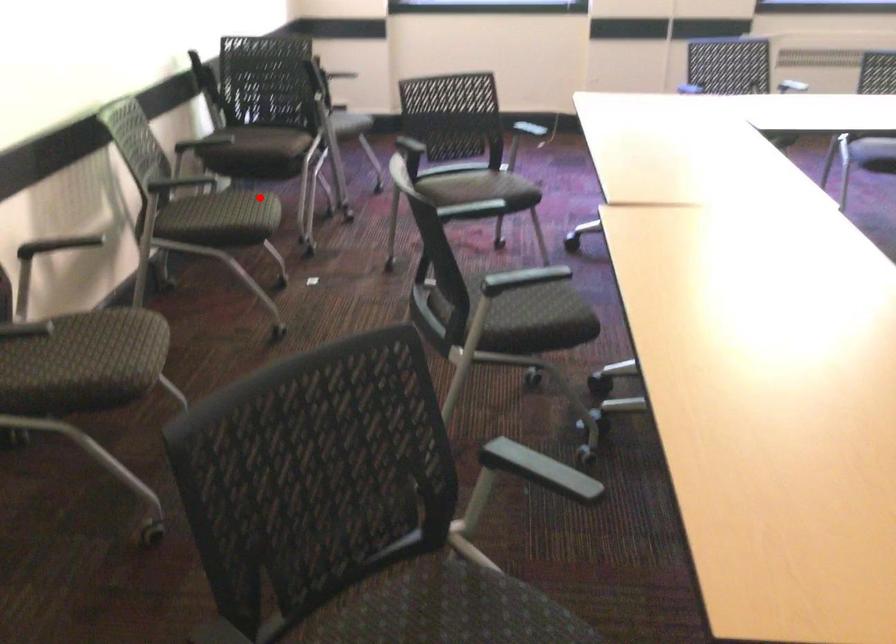
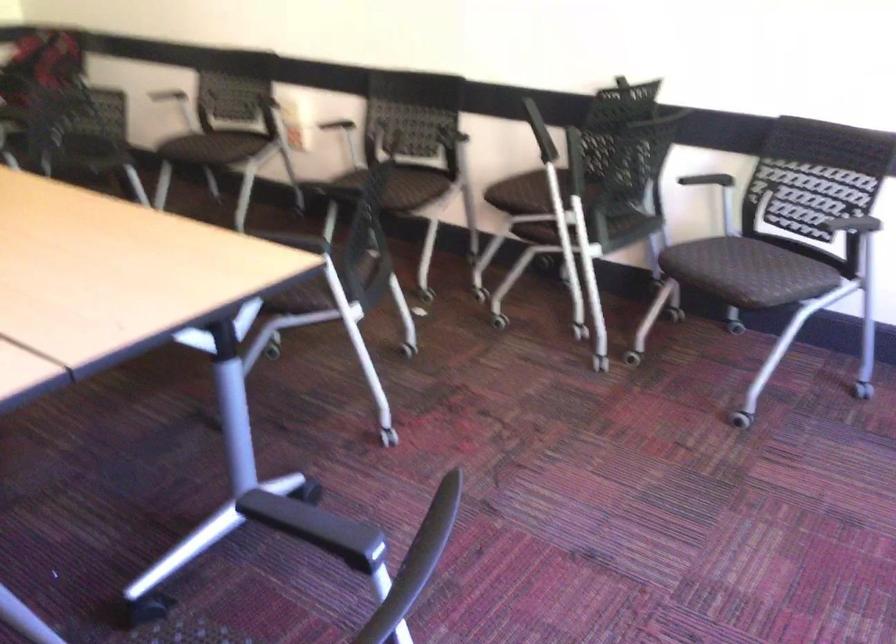
Where in the second image is the point corresponding to the highlighted location from the first image?

(402, 187)